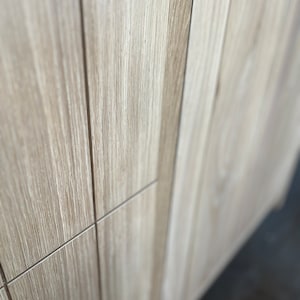
You are a GUI agent. You are given a task and a screenshot of the screen. Output one action in this format:
    pyautogui.click(x=<x>, y=<y>)
    Task: Click on the floor
    
    Given the screenshot: What is the action you would take?
    pyautogui.click(x=274, y=279)